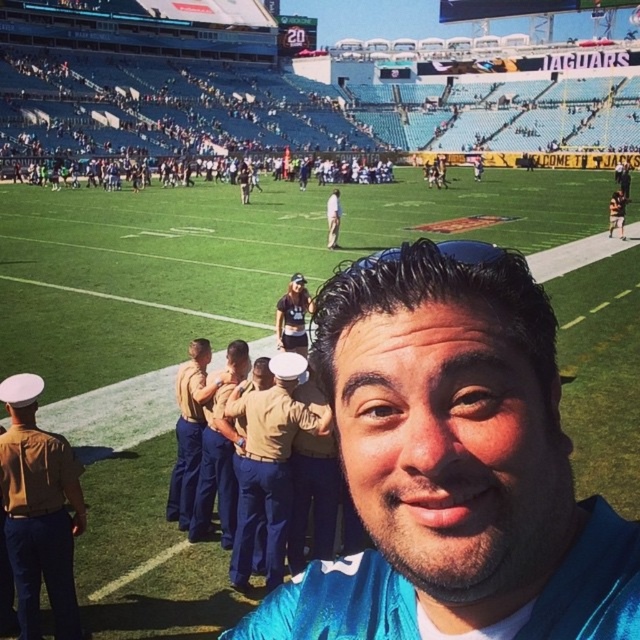
Where is `khaki uniform at center`? khaki uniform at center is located at coordinates (189, 429).

Is khaki uniform at center smaller than khaki uniform pants at center?

Yes, khaki uniform at center is smaller than khaki uniform pants at center.

Is point (193, 460) in front of point (333, 196)?

Yes, point (193, 460) is in front of point (333, 196).

At what (x,y) coordinates should I click in order to perform the action: click on khaki uniform at center. Please return your answer as a coordinate pair (x, y). The image size is (640, 640). Looking at the image, I should click on (189, 429).

Between blue fabric shirt at center and khaki uniform pants at center, which one is positioned higher?

khaki uniform pants at center is higher up.

Where is `blue fabric shirt at center`? blue fabric shirt at center is located at coordinates (452, 465).

Identify the location of blue fabric shirt at center. The height and width of the screenshot is (640, 640). (452, 465).

Consider the image. Which is below, blue fabric shirt at center or khaki uniform at center?

khaki uniform at center is lower down.

What are the coordinates of `blue fabric shirt at center` in the screenshot? It's located at (452, 465).

Find the location of a particular element. The height and width of the screenshot is (640, 640). blue fabric shirt at center is located at coordinates (452, 465).